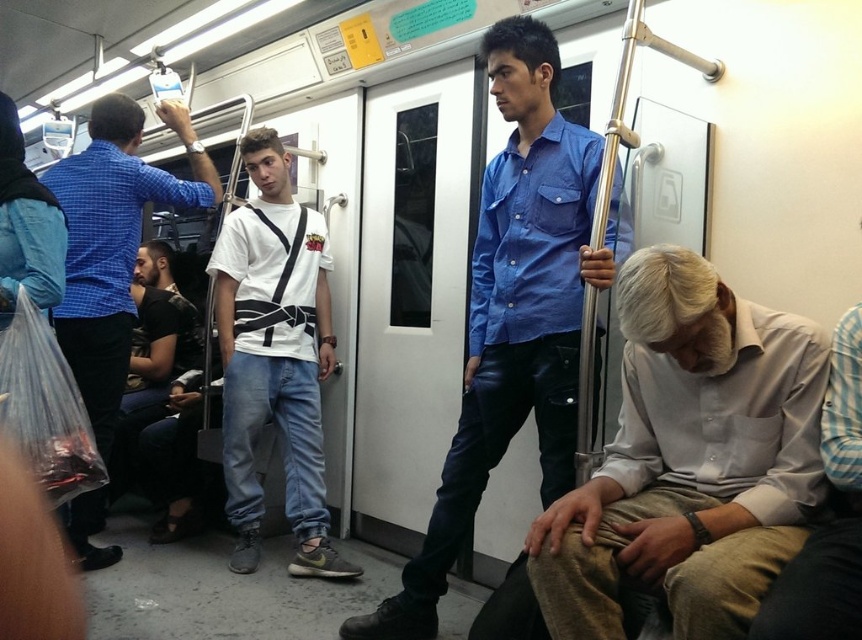
Is blue cotton shirt at center above brushed metal shirt at left?

No.

Is blue cotton shirt at center positioned before brushed metal shirt at left?

Yes, it is in front of brushed metal shirt at left.

At what (x,y) coordinates should I click in order to perform the action: click on blue cotton shirt at center. Please return your answer as a coordinate pair (x, y). This screenshot has height=640, width=862. Looking at the image, I should click on (514, 312).

Is white matte t-shirt at center taller than brushed metal shirt at left?

Yes.

Is white matte t-shirt at center positioned at the back of brushed metal shirt at left?

Yes, white matte t-shirt at center is behind brushed metal shirt at left.

Is point (242, 278) positioned before point (113, 413)?

That is False.

Locate an element on the screen. Image resolution: width=862 pixels, height=640 pixels. white matte t-shirt at center is located at coordinates (273, 356).

What do you see at coordinates (689, 460) in the screenshot? This screenshot has width=862, height=640. I see `gray cotton shirt at lower right` at bounding box center [689, 460].

You are a GUI agent. You are given a task and a screenshot of the screen. Output one action in this format:
    pyautogui.click(x=<x>, y=<y>)
    Task: Click on the gray cotton shirt at lower right
    
    Given the screenshot: What is the action you would take?
    pyautogui.click(x=689, y=460)